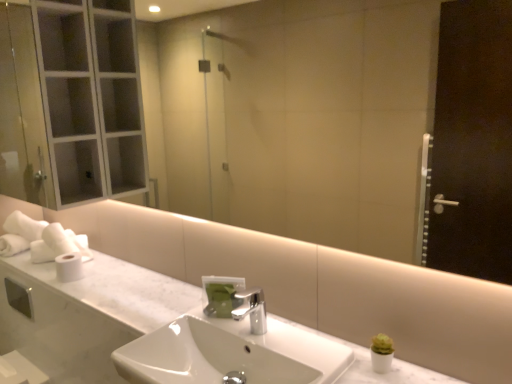
Locate an element on the screen. This screenshot has height=384, width=512. vacant space to the right of white matte toilet paper at left, the first toilet paper from the back is located at coordinates (89, 260).